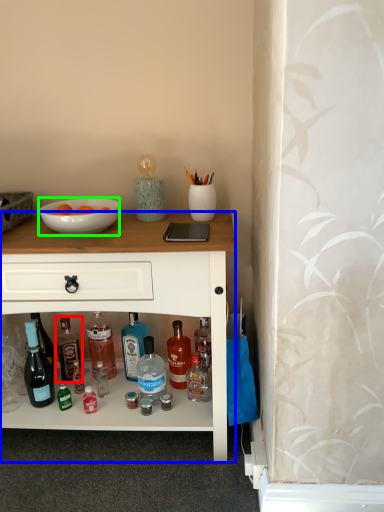
Question: Which object is the closest to the bottle (highlighted by a red box)? Choose among these: desk (highlighted by a blue box) or bowl (highlighted by a green box).

Choices:
 (A) desk
 (B) bowl

Answer: (A)